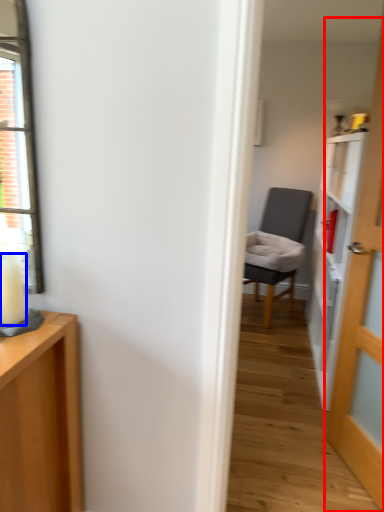
Question: Which point is closer to the camera, door (highlighted by a red box) or candle (highlighted by a blue box)?

Choices:
 (A) door
 (B) candle

Answer: (B)